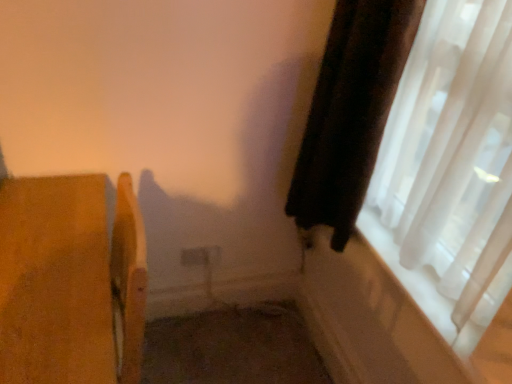
Question: From a real-world perspective, does translucent white curtain at right sit lower than velvet dark brown curtain at right?

Choices:
 (A) yes
 (B) no

Answer: (B)

Question: Is translucent white curtain at right oriented towards velvet dark brown curtain at right?

Choices:
 (A) yes
 (B) no

Answer: (A)

Question: From the image's perspective, is translucent white curtain at right above velvet dark brown curtain at right?

Choices:
 (A) no
 (B) yes

Answer: (A)

Question: Is translucent white curtain at right wider than velvet dark brown curtain at right?

Choices:
 (A) no
 (B) yes

Answer: (A)

Question: Does translucent white curtain at right touch velvet dark brown curtain at right?

Choices:
 (A) no
 (B) yes

Answer: (A)

Question: In the image, is velvet dark brown curtain at right on the left side or the right side of wooden chair at left?

Choices:
 (A) left
 (B) right

Answer: (B)

Question: Is velvet dark brown curtain at right inside or outside of wooden chair at left?

Choices:
 (A) inside
 (B) outside

Answer: (B)

Question: Is velvet dark brown curtain at right bigger or smaller than wooden chair at left?

Choices:
 (A) big
 (B) small

Answer: (B)

Question: In terms of height, does velvet dark brown curtain at right look taller or shorter compared to wooden chair at left?

Choices:
 (A) short
 (B) tall

Answer: (A)

Question: In terms of height, does wooden chair at left look taller or shorter compared to translucent white curtain at right?

Choices:
 (A) short
 (B) tall

Answer: (B)

Question: Based on their sizes in the image, would you say wooden chair at left is bigger or smaller than translucent white curtain at right?

Choices:
 (A) small
 (B) big

Answer: (B)

Question: From the image's perspective, is wooden chair at left positioned above or below translucent white curtain at right?

Choices:
 (A) above
 (B) below

Answer: (B)

Question: Relative to translucent white curtain at right, is wooden chair at left in front or behind?

Choices:
 (A) front
 (B) behind

Answer: (B)

Question: Is wooden chair at left inside or outside of velvet dark brown curtain at right?

Choices:
 (A) inside
 (B) outside

Answer: (B)

Question: Considering the relative positions of wooden chair at left and velvet dark brown curtain at right in the image provided, is wooden chair at left to the left or to the right of velvet dark brown curtain at right?

Choices:
 (A) right
 (B) left

Answer: (B)